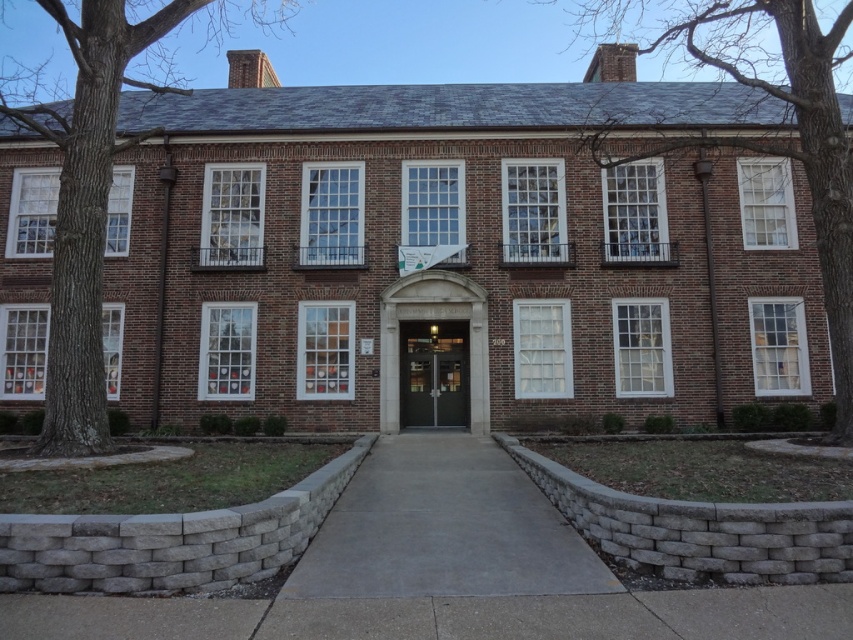
Is gray concrete pavement at center to the right of matte gray door at center from the viewer's perspective?

Correct, you'll find gray concrete pavement at center to the right of matte gray door at center.

Does point (479, 483) come behind point (407, 417)?

No.

What do you see at coordinates (444, 529) in the screenshot?
I see `gray concrete pavement at center` at bounding box center [444, 529].

Where is `gray concrete pavement at center`? gray concrete pavement at center is located at coordinates (444, 529).